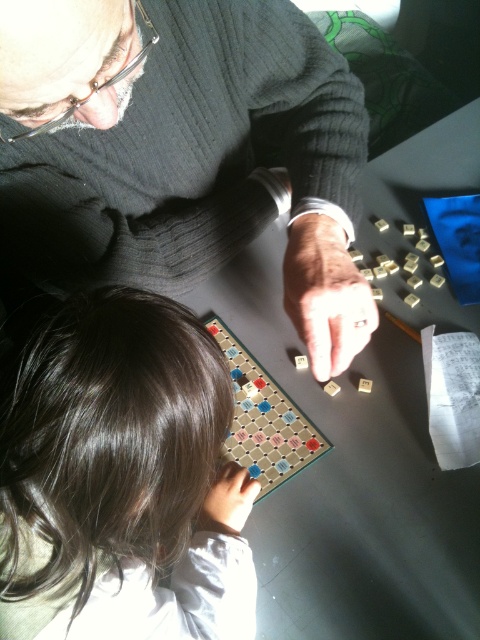
Who is shorter, smooth brown hair at lower left or wooden scrabble board at center?

wooden scrabble board at center is shorter.

Where is `smooth brown hair at lower left`? Image resolution: width=480 pixels, height=640 pixels. smooth brown hair at lower left is located at coordinates (122, 481).

Where is `smooth brown hair at lower left`? smooth brown hair at lower left is located at coordinates (122, 481).

How far apart are matte black scrabble tiles at center and smooth brown hair at lower left?

They are 11.29 inches apart.

Which is more to the left, matte black scrabble tiles at center or smooth brown hair at lower left?

Positioned to the left is smooth brown hair at lower left.

Measure the distance between matte black scrabble tiles at center and camera.

They are 11.84 inches apart.

The width and height of the screenshot is (480, 640). I want to click on matte black scrabble tiles at center, so pyautogui.click(x=181, y=152).

Between point (186, 76) and point (290, 476), which one is positioned in front?

Point (290, 476) is in front.

Which is above, matte black scrabble tiles at center or wooden scrabble board at center?

matte black scrabble tiles at center

What do you see at coordinates (181, 152) in the screenshot? This screenshot has height=640, width=480. I see `matte black scrabble tiles at center` at bounding box center [181, 152].

Where is `matte black scrabble tiles at center`? The height and width of the screenshot is (640, 480). matte black scrabble tiles at center is located at coordinates (x=181, y=152).